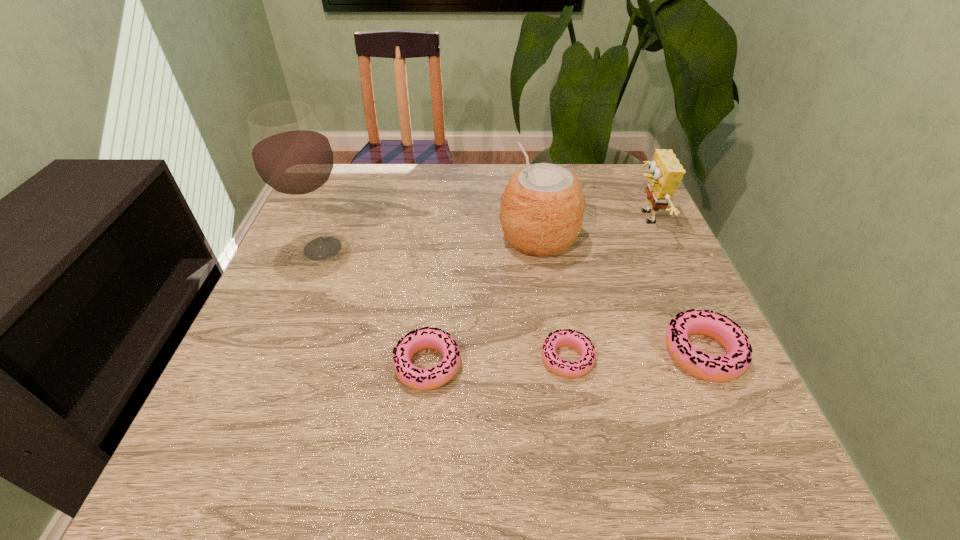
Image resolution: width=960 pixels, height=540 pixels. Identify the location of free space located on the left of the second shortest doughnut. (309, 365).

Find the location of a particular element. The height and width of the screenshot is (540, 960). vacant region located 0.400m on the back of the second doughnut from right to left is located at coordinates (542, 217).

Find the location of a particular element. vacant space positioned 0.130m on the left of the tallest doughnut is located at coordinates pos(596,353).

In order to click on free space located on the front of the fifth shortest object in this screenshot , I will do `click(551, 318)`.

I want to click on blank space located 0.200m on the face of the sponge, so click(x=555, y=218).

I want to click on free space located on the face of the sponge, so click(x=516, y=218).

The height and width of the screenshot is (540, 960). In order to click on blank space located 0.260m on the face of the sponge in this screenshot , I will do `click(532, 218)`.

Locate an element on the screen. free space located 0.300m on the back of the tallest object is located at coordinates (354, 167).

Identify the location of object positioned at the far edge. (666, 172).

I want to click on object at the left edge, so click(x=291, y=154).